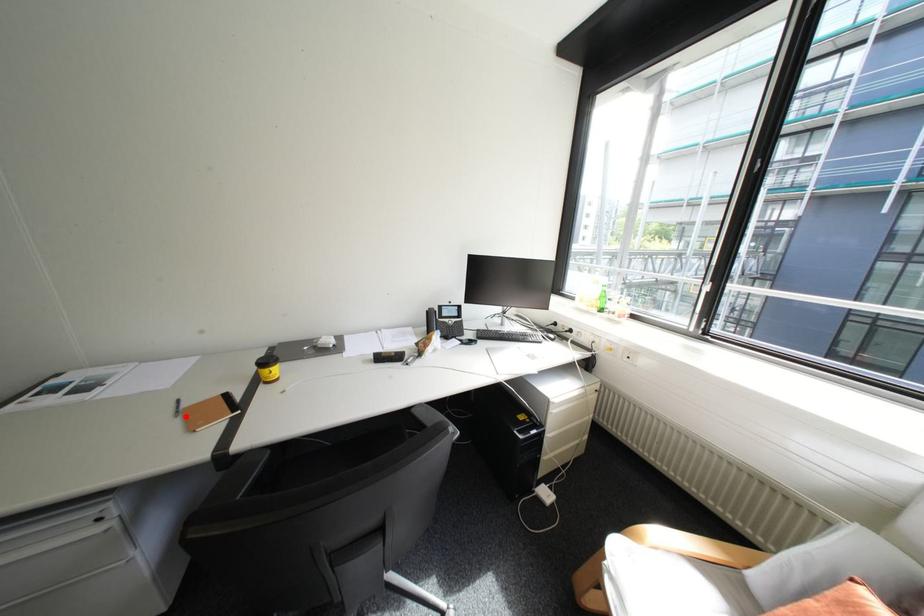
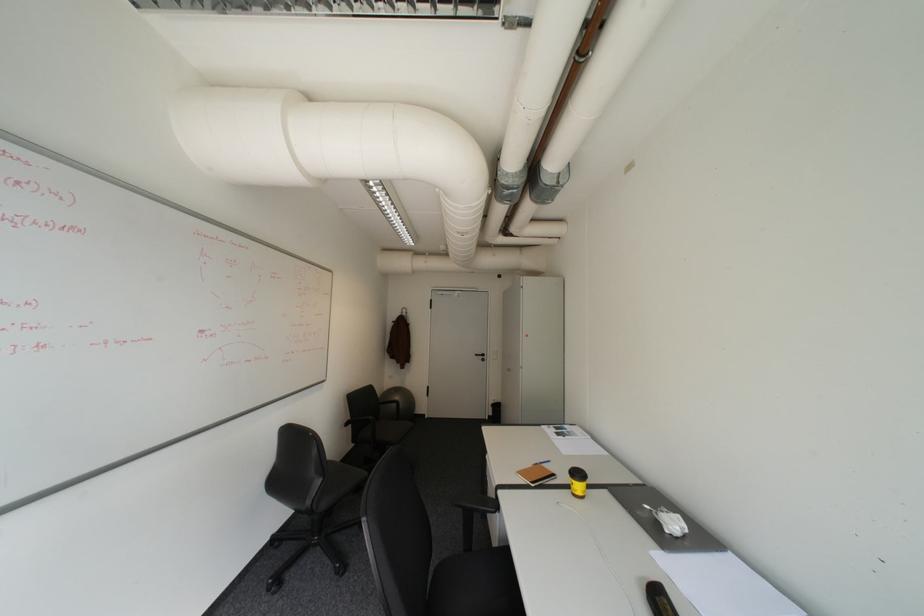
In the second image, find the point that corresponds to the highlighted location in the first image.

(543, 464)